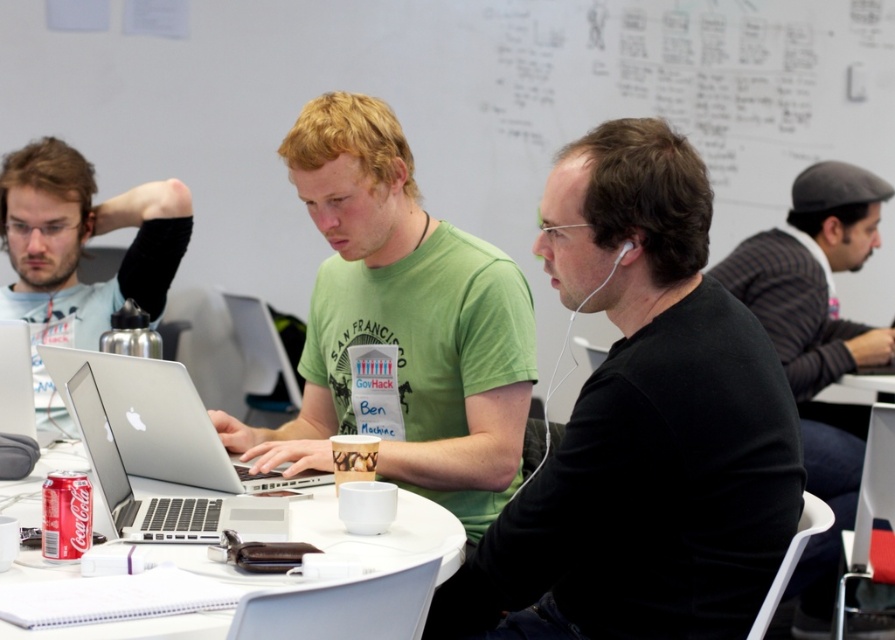
You are standing in the room and want to find the black matte shirt at center. Where should you look?

The black matte shirt at center is located at point 0.667 on the x axis and 0.718 on the y axis.